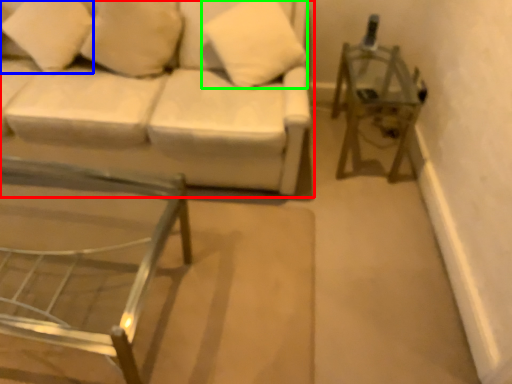
Question: Based on their relative distances, which object is nearer to studio couch (highlighted by a red box)? Choose from pillow (highlighted by a blue box) and pillow (highlighted by a green box).

Choices:
 (A) pillow
 (B) pillow

Answer: (B)